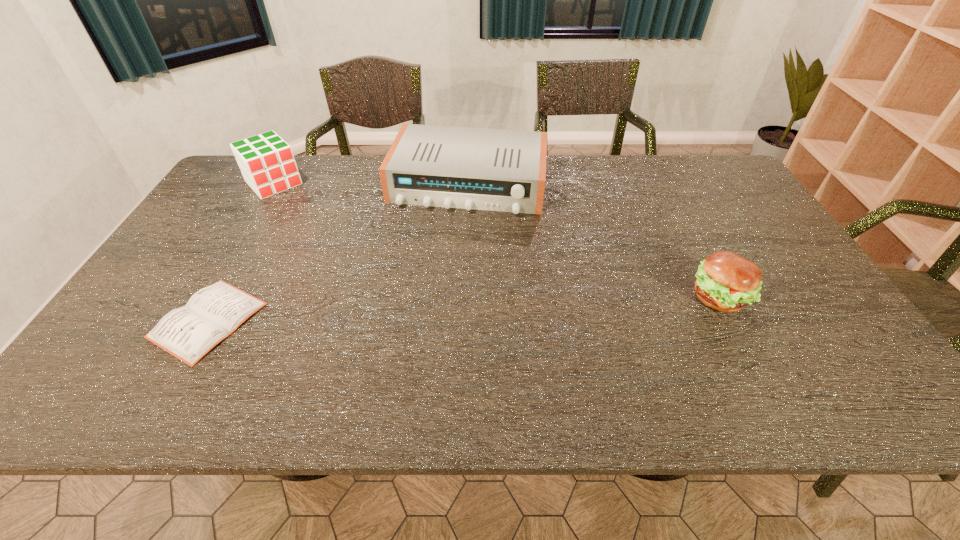
Identify the location of free space at the near edge of the desktop. (727, 349).

The width and height of the screenshot is (960, 540). In the image, there is a desktop. Identify the location of free space at the left edge. (218, 271).

In the image, there is a desktop. Identify the location of free space at the right edge. This screenshot has width=960, height=540. (713, 204).

At what (x,y) coordinates should I click in order to perform the action: click on vacant space at the near right corner. Please return your answer as a coordinate pair (x, y). The height and width of the screenshot is (540, 960). Looking at the image, I should click on (827, 357).

At what (x,y) coordinates should I click in order to perform the action: click on blank region between the radio receiver and the diary. Please return your answer as a coordinate pair (x, y). Looking at the image, I should click on (339, 252).

This screenshot has width=960, height=540. I want to click on free area in between the shortest object and the third object from left to right, so click(339, 252).

Locate an element on the screen. empty location between the cube and the hamburger is located at coordinates (496, 240).

What are the coordinates of `empty space between the radio receiver and the cube` in the screenshot? It's located at (372, 184).

The width and height of the screenshot is (960, 540). Find the location of `empty space that is in between the radio receiver and the hamburger`. empty space that is in between the radio receiver and the hamburger is located at coordinates (593, 241).

At what (x,y) coordinates should I click in order to perform the action: click on free area in between the rightmost object and the cube. Please return your answer as a coordinate pair (x, y). The width and height of the screenshot is (960, 540). Looking at the image, I should click on (496, 240).